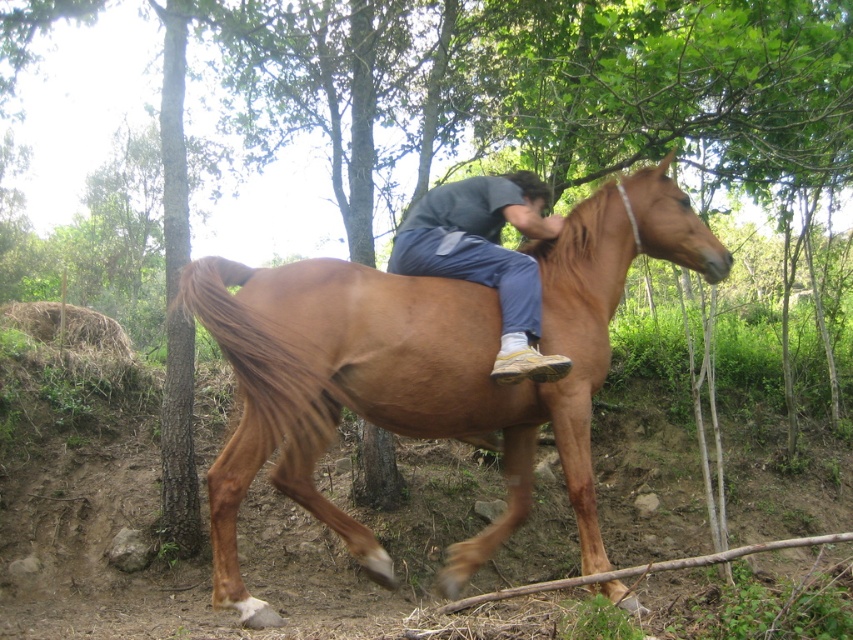
Who is more distant from viewer, (469, 568) or (488, 193)?

Positioned behind is point (488, 193).

Does brown glossy horse at center have a lesser width compared to matte blue jeans at center?

No, brown glossy horse at center is not thinner than matte blue jeans at center.

Does point (657, 241) come closer to viewer compared to point (523, 275)?

No, it is behind (523, 275).

The width and height of the screenshot is (853, 640). What are the coordinates of `brown glossy horse at center` in the screenshot? It's located at (426, 368).